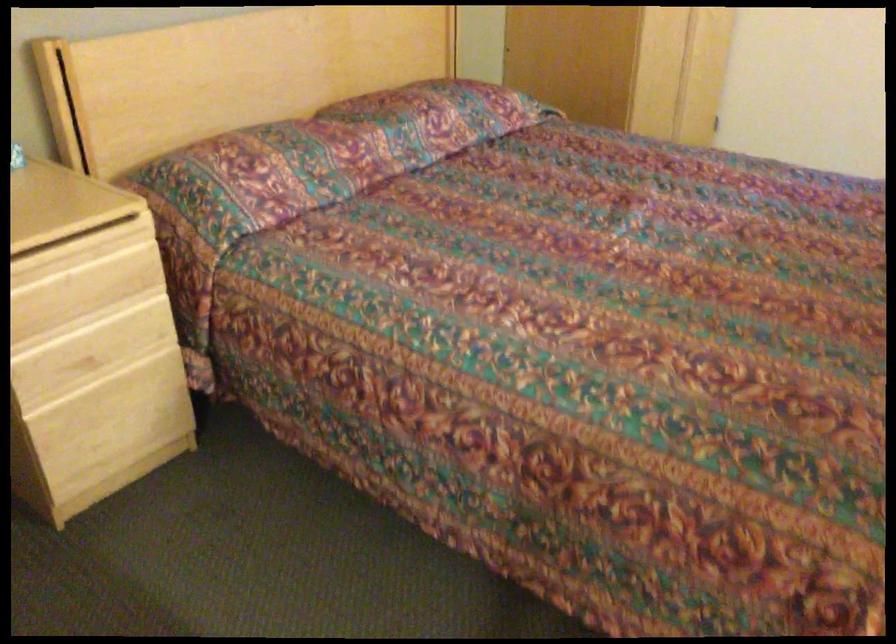
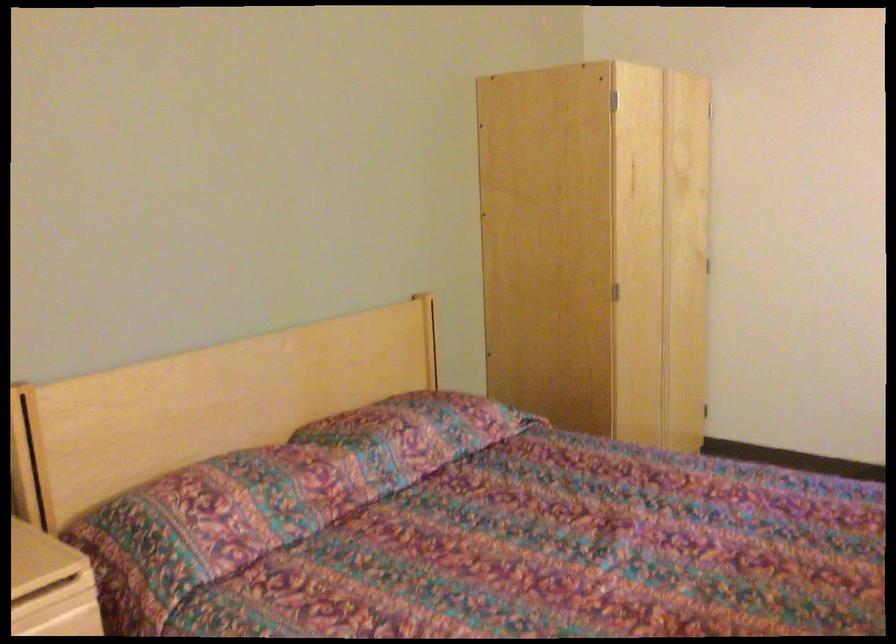
Locate, in the second image, the point that corresponds to (x=437, y=116) in the first image.

(414, 433)